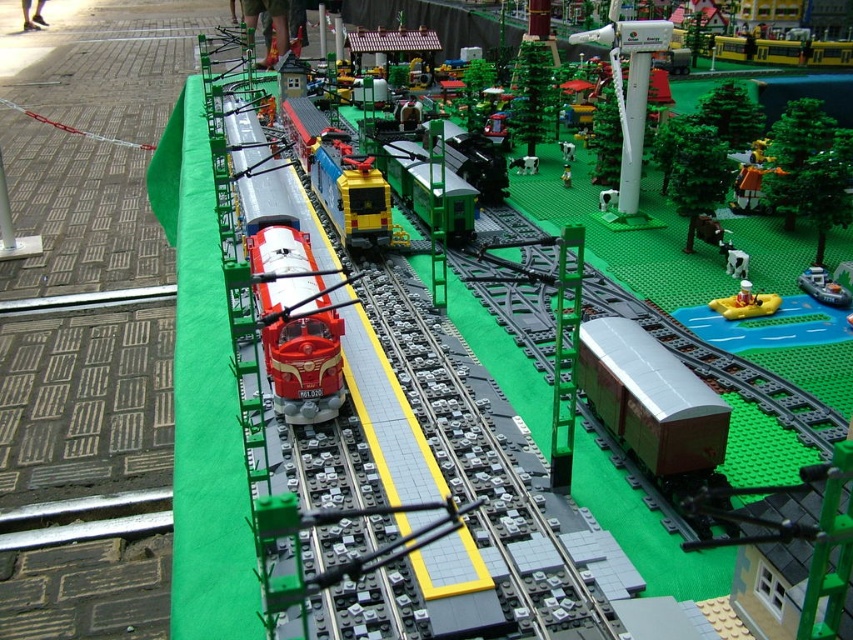
You are a Lego figure standing on the green baseplate. You need to decide which object is bigger between the white plastic wind turbine at upper center and the yellow rubber boat at lower right. Which one is bigger?

The white plastic wind turbine at upper center is larger in size compared to the yellow rubber boat at lower right.

You are a toy engineer designing a new Lego set. You need to place a new Lego figure between the white plastic wind turbine at upper center and the yellow rubber boat at lower right. What is the minimum length of the path the figure must walk to reach the boat from the wind turbine?

The minimum length of the path the figure must walk to reach the yellow rubber boat at lower right from the white plastic wind turbine at upper center is 50.91 centimeters.

You are a toy engineer inspecting the Lego train set. You notice the brown matte cargo train at center and the white plastic wind turbine at upper center. Which object is larger in size?

The brown matte cargo train at center has a smaller size compared to the white plastic wind turbine at upper center, so the white plastic wind turbine at upper center is larger in size.